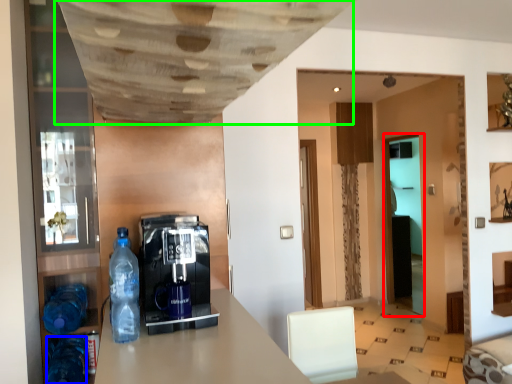
Question: Considering the real-world distances, which object is farthest from glass door (highlighted by a red box)? bottle (highlighted by a blue box) or exhaust hood (highlighted by a green box)?

Choices:
 (A) bottle
 (B) exhaust hood

Answer: (A)